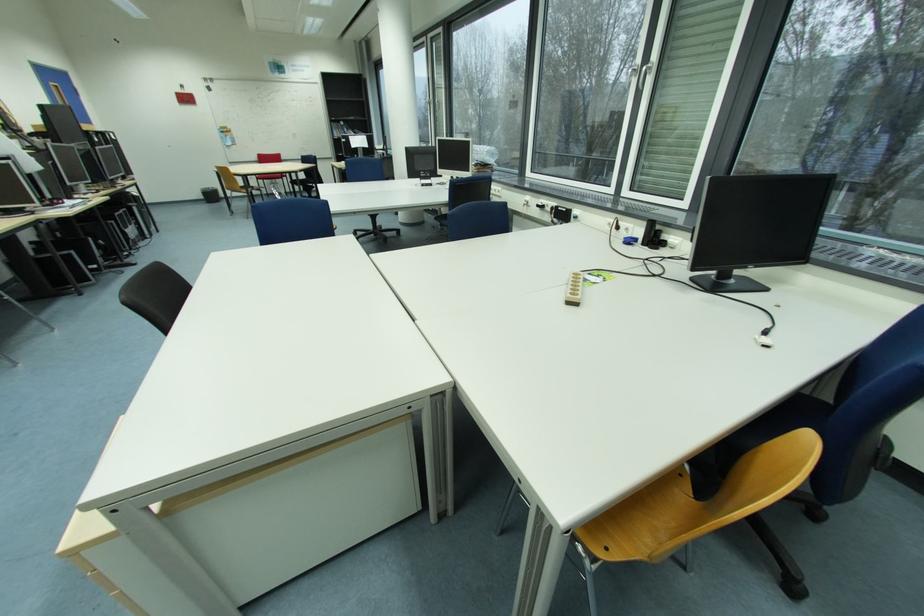
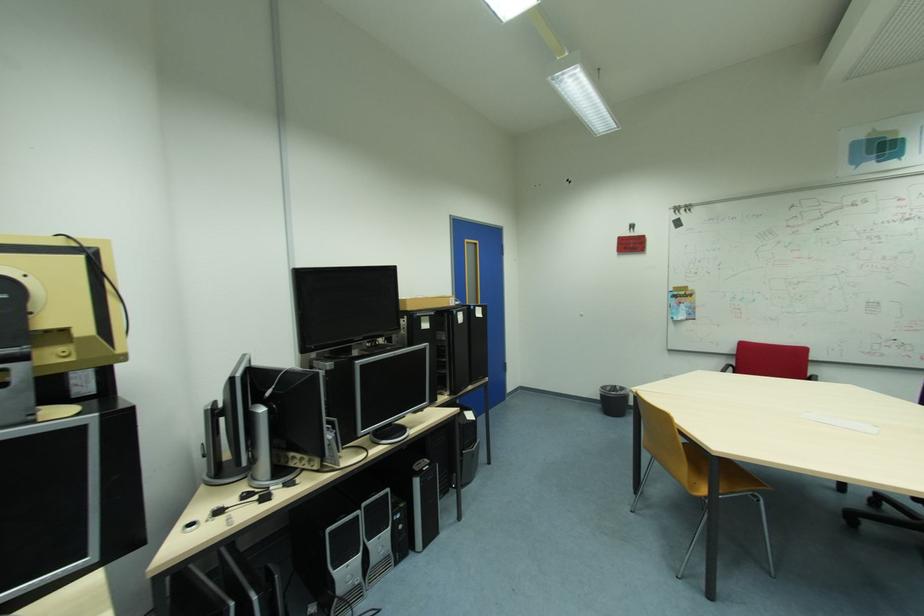
Where in the second image is the point corresponding to pixel 141 209 from the first image?

(424, 482)